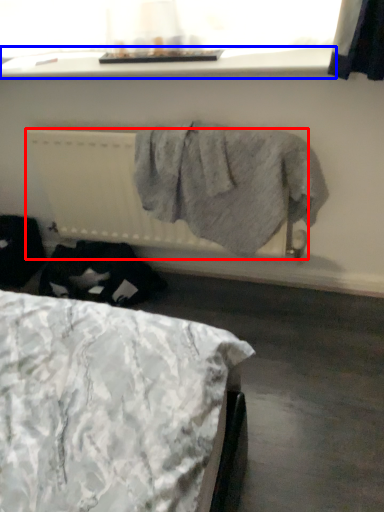
Question: Which point is closer to the camera, radiator (highlighted by a red box) or window sill (highlighted by a blue box)?

Choices:
 (A) radiator
 (B) window sill

Answer: (B)